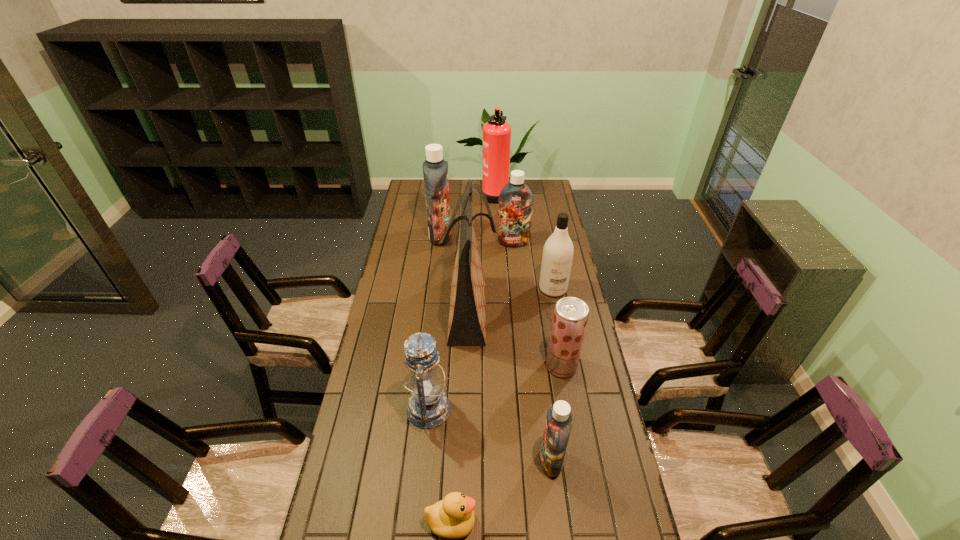
Identify the location of the second closest blue shampoo to the seventh farthest object. (435, 170).

This screenshot has height=540, width=960. I want to click on vacant space that satisfies the following two spatial constraints: 1. on the front-facing side of the second nearest shampoo; 2. on the front-facing side of the shopping bag, so click(x=557, y=309).